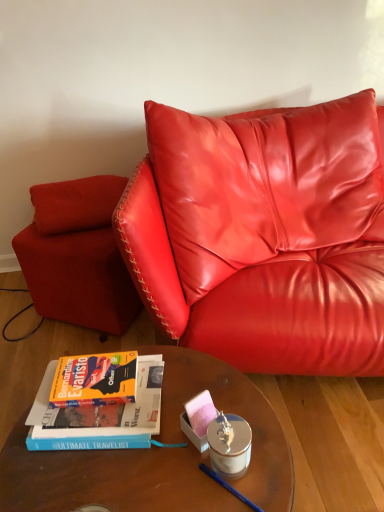
What are the coordinates of `free area behind silver metallic candle holder at center` in the screenshot? It's located at (223, 390).